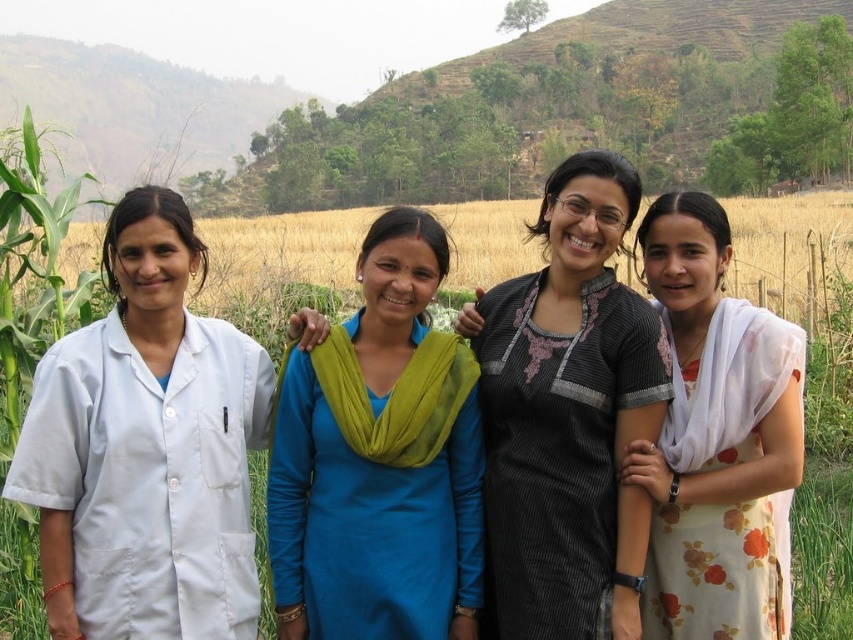
Between black striped dress at center and blue fabric dress at center, which one appears on the right side from the viewer's perspective?

From the viewer's perspective, black striped dress at center appears more on the right side.

Can you confirm if black striped dress at center is positioned to the left of blue fabric dress at center?

In fact, black striped dress at center is to the right of blue fabric dress at center.

Is point (572, 456) in front of point (474, 474)?

Yes.

You are a GUI agent. You are given a task and a screenshot of the screen. Output one action in this format:
    pyautogui.click(x=<x>, y=<y>)
    Task: Click on the black striped dress at center
    Image resolution: width=853 pixels, height=640 pixels.
    Given the screenshot: What is the action you would take?
    pyautogui.click(x=567, y=416)

Does black striped dress at center appear on the left side of yellow grassland at center?

Indeed, black striped dress at center is positioned on the left side of yellow grassland at center.

This screenshot has height=640, width=853. What do you see at coordinates (567, 416) in the screenshot?
I see `black striped dress at center` at bounding box center [567, 416].

Identify the location of black striped dress at center. This screenshot has width=853, height=640. (567, 416).

Does blue fabric dress at center appear on the left side of floral dress at right?

Indeed, blue fabric dress at center is positioned on the left side of floral dress at right.

Between blue fabric dress at center and floral dress at right, which one is positioned higher?

floral dress at right is above.

Does point (412, 548) come closer to viewer compared to point (697, 397)?

Yes, point (412, 548) is closer to viewer.

Where is `blue fabric dress at center`? Image resolution: width=853 pixels, height=640 pixels. blue fabric dress at center is located at coordinates (370, 524).